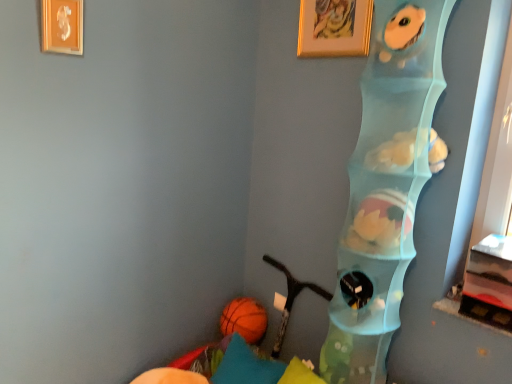
Question: Does orange rubber ball at lower left have a lesser height compared to translucent plastic shelf at right?

Choices:
 (A) no
 (B) yes

Answer: (B)

Question: Does orange rubber ball at lower left have a lesser width compared to translucent plastic shelf at right?

Choices:
 (A) yes
 (B) no

Answer: (A)

Question: Does orange rubber ball at lower left appear on the left side of translucent plastic shelf at right?

Choices:
 (A) yes
 (B) no

Answer: (A)

Question: Does orange rubber ball at lower left appear on the right side of translucent plastic shelf at right?

Choices:
 (A) yes
 (B) no

Answer: (B)

Question: From a real-world perspective, is orange rubber ball at lower left located beneath translucent plastic shelf at right?

Choices:
 (A) no
 (B) yes

Answer: (B)

Question: Can you confirm if orange rubber ball at lower left is bigger than translucent plastic shelf at right?

Choices:
 (A) no
 (B) yes

Answer: (A)

Question: Does gold metallic picture frame at upper left, the 2th picture frame from the right, have a greater width compared to fluffy blue plush toy at upper right, arranged as the first animal when viewed from the top?

Choices:
 (A) yes
 (B) no

Answer: (B)

Question: Can you confirm if gold metallic picture frame at upper left, the second picture frame positioned from the back, is taller than fluffy blue plush toy at upper right, the second animal positioned from the bottom?

Choices:
 (A) no
 (B) yes

Answer: (B)

Question: From the image's perspective, is gold metallic picture frame at upper left, the 1th picture frame in the left-to-right sequence, below fluffy blue plush toy at upper right, the second animal positioned from the bottom?

Choices:
 (A) yes
 (B) no

Answer: (B)

Question: Would you say gold metallic picture frame at upper left, the 2th picture frame from the right, contains fluffy blue plush toy at upper right, arranged as the first animal when viewed from the top?

Choices:
 (A) no
 (B) yes

Answer: (A)

Question: Is gold metallic picture frame at upper left, positioned as the 1th picture frame in front-to-back order, located outside fluffy blue plush toy at upper right, arranged as the first animal when viewed from the top?

Choices:
 (A) no
 (B) yes

Answer: (B)

Question: Is gold metallic picture frame at upper left, the 1th picture frame in the left-to-right sequence, further to camera compared to fluffy blue plush toy at upper right, arranged as the first animal when viewed from the top?

Choices:
 (A) no
 (B) yes

Answer: (B)

Question: Can you confirm if teal fabric pillow at lower left is thinner than white plush toy at center, the 1th animal positioned from the bottom?

Choices:
 (A) yes
 (B) no

Answer: (B)